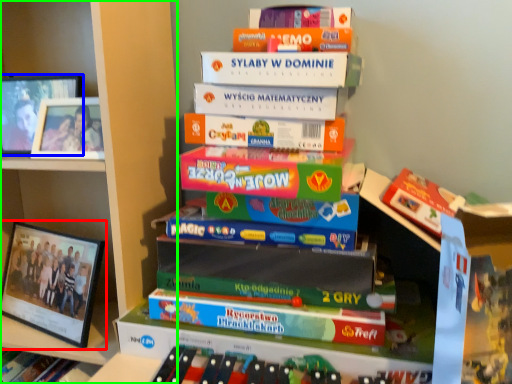
Question: Which is farther away from picture frame (highlighted by a red box)? picture frame (highlighted by a blue box) or bookcase (highlighted by a green box)?

Choices:
 (A) picture frame
 (B) bookcase

Answer: (A)